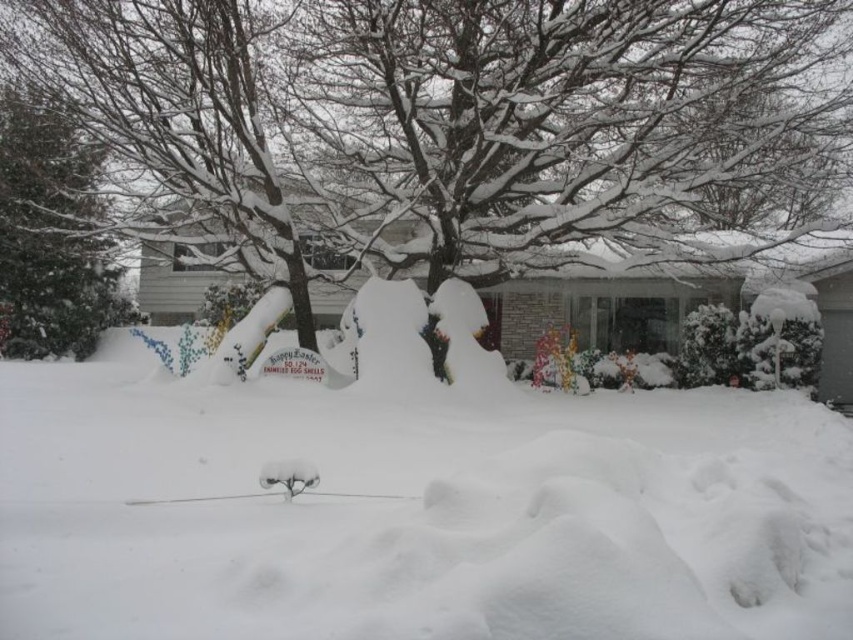
Question: Is white snow-covered tree at center thinner than green leafy tree at left?

Choices:
 (A) yes
 (B) no

Answer: (B)

Question: Among these points, which one is nearest to the camera?

Choices:
 (A) (253, 488)
 (B) (41, 273)

Answer: (A)

Question: Considering the real-world distances, which object is closest to the green leafy tree at left?

Choices:
 (A) white snow-covered tree at center
 (B) white fluffy snow at center

Answer: (A)

Question: Is white fluffy snow at center smaller than white snow-covered tree at center?

Choices:
 (A) no
 (B) yes

Answer: (B)

Question: Based on their relative distances, which object is farther from the green leafy tree at left?

Choices:
 (A) white snow-covered tree at center
 (B) white fluffy snow at center

Answer: (B)

Question: Is white fluffy snow at center further to camera compared to white snow-covered tree at center?

Choices:
 (A) no
 (B) yes

Answer: (A)